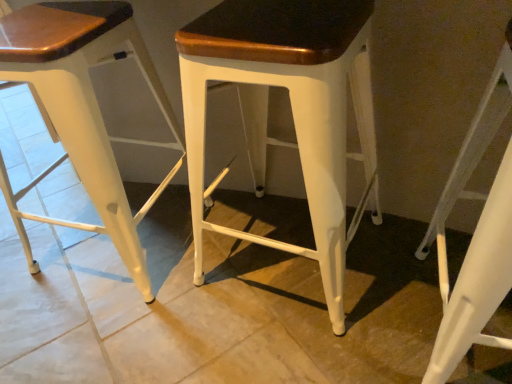
What do you see at coordinates (82, 110) in the screenshot? I see `white metal stool at center, which is counted as the third stool, starting from the right` at bounding box center [82, 110].

Measure the distance between white matte stool at lower right, which is the 1th stool in right-to-left order, and camera.

A distance of 19.21 inches exists between white matte stool at lower right, which is the 1th stool in right-to-left order, and camera.

Image resolution: width=512 pixels, height=384 pixels. What are the coordinates of `white metal stool at center, which is the first stool in left-to-right order` in the screenshot? It's located at (82, 110).

Considering the sizes of objects white matte stool at center, marked as the 2th stool in a left-to-right arrangement, and white metal stool at center, which is counted as the third stool, starting from the right, in the image provided, who is taller, white matte stool at center, marked as the 2th stool in a left-to-right arrangement, or white metal stool at center, which is counted as the third stool, starting from the right,?

white matte stool at center, marked as the 2th stool in a left-to-right arrangement.

Is white matte stool at center, positioned as the 2th stool in right-to-left order, further to the viewer compared to white metal stool at center, which is the first stool in left-to-right order?

No, white matte stool at center, positioned as the 2th stool in right-to-left order, is in front of white metal stool at center, which is the first stool in left-to-right order.

At what (x,y) coordinates should I click in order to perform the action: click on stool that appears above the white matte stool at center, marked as the 2th stool in a left-to-right arrangement (from the image's perspective). Please return your answer as a coordinate pair (x, y). Looking at the image, I should click on (82, 110).

Is there a large distance between white matte stool at center, positioned as the 2th stool in right-to-left order, and white metal stool at center, which is counted as the third stool, starting from the right?

white matte stool at center, positioned as the 2th stool in right-to-left order, is actually quite close to white metal stool at center, which is counted as the third stool, starting from the right.

From a real-world perspective, is white matte stool at center, marked as the 2th stool in a left-to-right arrangement, physically located above or below white matte stool at lower right, which is the 1th stool in right-to-left order?

In terms of real-world spatial position, white matte stool at center, marked as the 2th stool in a left-to-right arrangement, is above white matte stool at lower right, which is the 1th stool in right-to-left order.

Can you confirm if white matte stool at center, marked as the 2th stool in a left-to-right arrangement, is positioned to the left of white matte stool at lower right, which is the 1th stool in right-to-left order?

Correct, you'll find white matte stool at center, marked as the 2th stool in a left-to-right arrangement, to the left of white matte stool at lower right, which is the 1th stool in right-to-left order.

Consider the image. Between white matte stool at center, positioned as the 2th stool in right-to-left order, and white matte stool at lower right, which is the 1th stool in right-to-left order, which one has more height?

white matte stool at center, positioned as the 2th stool in right-to-left order.

From the image's perspective, is white matte stool at center, positioned as the 2th stool in right-to-left order, located beneath white matte stool at lower right, positioned as the 3th stool in left-to-right order?

No, from the image's perspective, white matte stool at center, positioned as the 2th stool in right-to-left order, is not below white matte stool at lower right, positioned as the 3th stool in left-to-right order.

What's the angular difference between white matte stool at lower right, positioned as the 3th stool in left-to-right order, and white matte stool at center, positioned as the 2th stool in right-to-left order,'s facing directions?

9.35 degrees separate the facing orientations of white matte stool at lower right, positioned as the 3th stool in left-to-right order, and white matte stool at center, positioned as the 2th stool in right-to-left order.

From the image's perspective, which one is positioned higher, white matte stool at lower right, which is the 1th stool in right-to-left order, or white matte stool at center, marked as the 2th stool in a left-to-right arrangement?

white matte stool at center, marked as the 2th stool in a left-to-right arrangement, is shown above in the image.

From the picture: Is white matte stool at lower right, positioned as the 3th stool in left-to-right order, bigger or smaller than white matte stool at center, marked as the 2th stool in a left-to-right arrangement?

In the image, white matte stool at lower right, positioned as the 3th stool in left-to-right order, appears to be smaller than white matte stool at center, marked as the 2th stool in a left-to-right arrangement.

Which is in front, white matte stool at lower right, positioned as the 3th stool in left-to-right order, or white matte stool at center, marked as the 2th stool in a left-to-right arrangement?

white matte stool at lower right, positioned as the 3th stool in left-to-right order, is in front.

Visually, is white matte stool at lower right, which is the 1th stool in right-to-left order, positioned to the left or to the right of white metal stool at center, which is counted as the third stool, starting from the right?

white matte stool at lower right, which is the 1th stool in right-to-left order, is to the right of white metal stool at center, which is counted as the third stool, starting from the right.

Between white matte stool at lower right, which is the 1th stool in right-to-left order, and white metal stool at center, which is the first stool in left-to-right order, which one is positioned behind?

white metal stool at center, which is the first stool in left-to-right order.

Between white matte stool at lower right, positioned as the 3th stool in left-to-right order, and white metal stool at center, which is the first stool in left-to-right order, which one has smaller width?

Thinner between the two is white matte stool at lower right, positioned as the 3th stool in left-to-right order.

Is white matte stool at lower right, positioned as the 3th stool in left-to-right order, not near white metal stool at center, which is the first stool in left-to-right order?

No.

From the image's perspective, is white metal stool at center, which is the first stool in left-to-right order, on white matte stool at center, positioned as the 2th stool in right-to-left order?

Yes, from the image's perspective, white metal stool at center, which is the first stool in left-to-right order, is above white matte stool at center, positioned as the 2th stool in right-to-left order.

Is white metal stool at center, which is the first stool in left-to-right order, shorter than white matte stool at center, positioned as the 2th stool in right-to-left order?

Yes.

Does point (41, 16) lie in front of point (258, 184)?

Yes, it is in front of point (258, 184).

Are white metal stool at center, which is the first stool in left-to-right order, and white matte stool at center, marked as the 2th stool in a left-to-right arrangement, far apart?

That's not correct — white metal stool at center, which is the first stool in left-to-right order, is a little close to white matte stool at center, marked as the 2th stool in a left-to-right arrangement.

What's the angular difference between white metal stool at center, which is the first stool in left-to-right order, and white matte stool at lower right, which is the 1th stool in right-to-left order,'s facing directions?

2.34 degrees separate the facing orientations of white metal stool at center, which is the first stool in left-to-right order, and white matte stool at lower right, which is the 1th stool in right-to-left order.

Considering the relative positions of white metal stool at center, which is the first stool in left-to-right order, and white matte stool at lower right, positioned as the 3th stool in left-to-right order, in the image provided, is white metal stool at center, which is the first stool in left-to-right order, to the left of white matte stool at lower right, positioned as the 3th stool in left-to-right order, from the viewer's perspective?

Correct, you'll find white metal stool at center, which is the first stool in left-to-right order, to the left of white matte stool at lower right, positioned as the 3th stool in left-to-right order.

Which is in front, white metal stool at center, which is counted as the third stool, starting from the right, or white matte stool at lower right, positioned as the 3th stool in left-to-right order?

white matte stool at lower right, positioned as the 3th stool in left-to-right order, is more forward.

From a real-world perspective, is white metal stool at center, which is counted as the third stool, starting from the right, physically above white matte stool at lower right, which is the 1th stool in right-to-left order?

Yes, from a real-world perspective, white metal stool at center, which is counted as the third stool, starting from the right, is over white matte stool at lower right, which is the 1th stool in right-to-left order

Where is `the 1st stool in front of the white metal stool at center, which is counted as the third stool, starting from the right, starting your count from the anchor`? the 1st stool in front of the white metal stool at center, which is counted as the third stool, starting from the right, starting your count from the anchor is located at coordinates (291, 107).

Locate an element on the screen. Image resolution: width=512 pixels, height=384 pixels. stool below the white matte stool at center, positioned as the 2th stool in right-to-left order (from the image's perspective) is located at coordinates (475, 235).

Which object lies further to the anchor point white metal stool at center, which is the first stool in left-to-right order, white matte stool at center, marked as the 2th stool in a left-to-right arrangement, or white matte stool at lower right, which is the 1th stool in right-to-left order?

Among the two, white matte stool at lower right, which is the 1th stool in right-to-left order, is located further to white metal stool at center, which is the first stool in left-to-right order.

In the scene shown: From the image, which object appears to be farther from white metal stool at center, which is counted as the third stool, starting from the right, white matte stool at lower right, positioned as the 3th stool in left-to-right order, or white matte stool at center, positioned as the 2th stool in right-to-left order?

white matte stool at lower right, positioned as the 3th stool in left-to-right order, lies further to white metal stool at center, which is counted as the third stool, starting from the right, than the other object.

Estimate the real-world distances between objects in this image. Which object is closer to white matte stool at lower right, which is the 1th stool in right-to-left order, white matte stool at center, marked as the 2th stool in a left-to-right arrangement, or white metal stool at center, which is the first stool in left-to-right order?

Among the two, white matte stool at center, marked as the 2th stool in a left-to-right arrangement, is located nearer to white matte stool at lower right, which is the 1th stool in right-to-left order.

When comparing their distances from white matte stool at lower right, positioned as the 3th stool in left-to-right order, does white metal stool at center, which is counted as the third stool, starting from the right, or white matte stool at center, positioned as the 2th stool in right-to-left order, seem further?

The object further to white matte stool at lower right, positioned as the 3th stool in left-to-right order, is white metal stool at center, which is counted as the third stool, starting from the right.

When comparing their distances from white matte stool at center, marked as the 2th stool in a left-to-right arrangement, does white matte stool at lower right, positioned as the 3th stool in left-to-right order, or white metal stool at center, which is the first stool in left-to-right order, seem closer?

Among the two, white matte stool at lower right, positioned as the 3th stool in left-to-right order, is located nearer to white matte stool at center, marked as the 2th stool in a left-to-right arrangement.

Considering their positions, is white metal stool at center, which is counted as the third stool, starting from the right, positioned closer to white matte stool at center, positioned as the 2th stool in right-to-left order, than white matte stool at lower right, positioned as the 3th stool in left-to-right order?

Based on the image, white matte stool at lower right, positioned as the 3th stool in left-to-right order, appears to be nearer to white matte stool at center, positioned as the 2th stool in right-to-left order.

At what (x,y) coordinates should I click in order to perform the action: click on stool situated between white metal stool at center, which is the first stool in left-to-right order, and white matte stool at lower right, which is the 1th stool in right-to-left order, from left to right. Please return your answer as a coordinate pair (x, y). The width and height of the screenshot is (512, 384). Looking at the image, I should click on (291, 107).